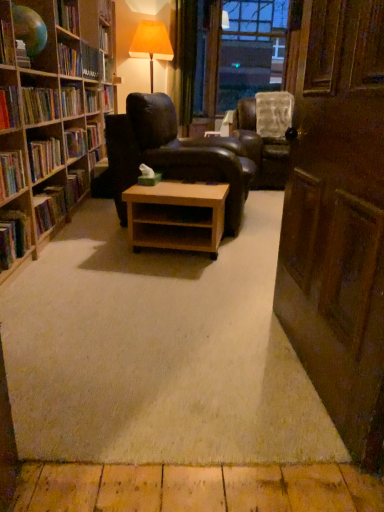
You are a GUI agent. You are given a task and a screenshot of the screen. Output one action in this format:
    pyautogui.click(x=<x>, y=<y>)
    Task: Click on the free space between light brown wood at center and wooden door at right
    
    Given the screenshot: What is the action you would take?
    pyautogui.click(x=216, y=307)